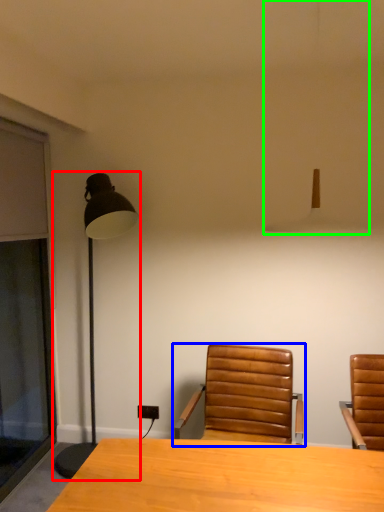
Question: Which object is the farthest from lamp (highlighted by a red box)? Choose among these: chair (highlighted by a blue box) or lamp (highlighted by a green box).

Choices:
 (A) chair
 (B) lamp

Answer: (A)